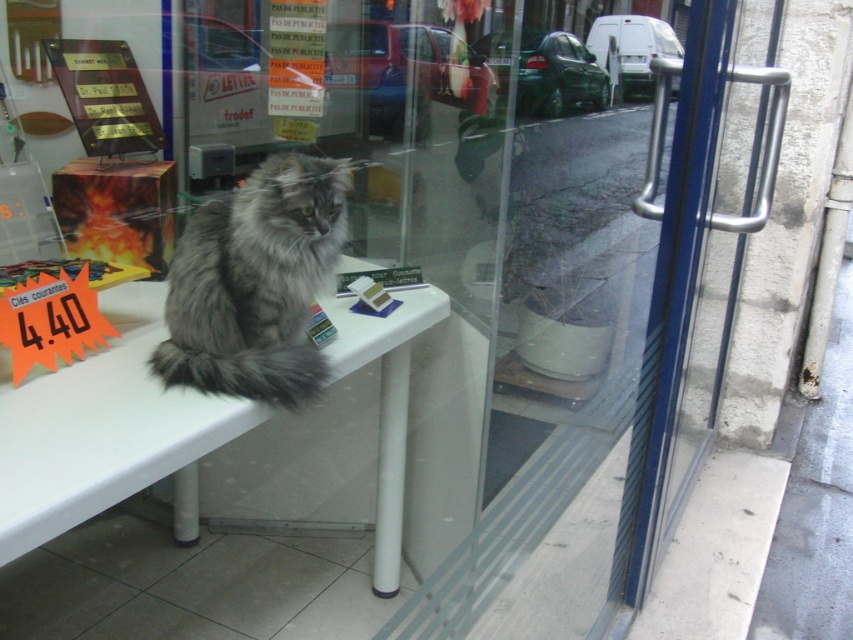
Question: Which point is closer to the camera?

Choices:
 (A) fuzzy gray cat at center
 (B) white plastic table at center

Answer: (B)

Question: Is white plastic table at center further to the viewer compared to fuzzy gray cat at center?

Choices:
 (A) yes
 (B) no

Answer: (B)

Question: Is white plastic table at center further to the viewer compared to fuzzy gray cat at center?

Choices:
 (A) yes
 (B) no

Answer: (B)

Question: In this image, where is white plastic table at center located relative to fuzzy gray cat at center?

Choices:
 (A) right
 (B) left

Answer: (B)

Question: Which point is farther to the camera?

Choices:
 (A) white plastic table at center
 (B) fuzzy gray cat at center

Answer: (B)